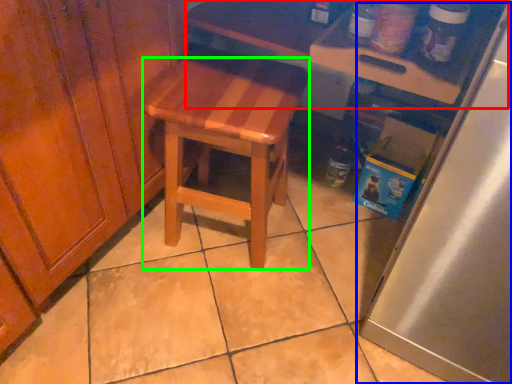
Question: Which object is positioned closest to table (highlighted by a red box)? Select from appliance (highlighted by a blue box) and stool (highlighted by a green box).

Choices:
 (A) appliance
 (B) stool

Answer: (B)